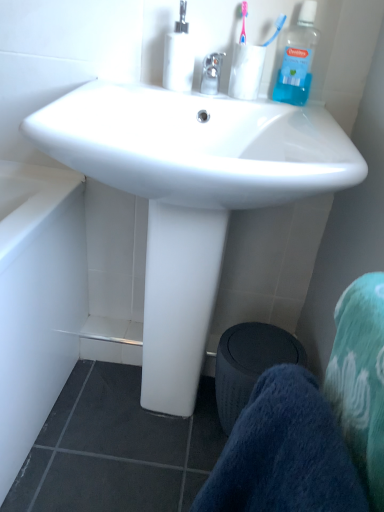
Question: Would you say black fabric trash bin/can at lower center is a long distance from transparent plastic cup at upper center?

Choices:
 (A) yes
 (B) no

Answer: (B)

Question: Is black fabric trash bin/can at lower center at the right side of transparent plastic cup at upper center?

Choices:
 (A) yes
 (B) no

Answer: (A)

Question: Can you confirm if black fabric trash bin/can at lower center is smaller than transparent plastic cup at upper center?

Choices:
 (A) yes
 (B) no

Answer: (B)

Question: Is black fabric trash bin/can at lower center at the left side of transparent plastic cup at upper center?

Choices:
 (A) yes
 (B) no

Answer: (B)

Question: Could transparent plastic cup at upper center be considered to be inside black fabric trash bin/can at lower center?

Choices:
 (A) yes
 (B) no

Answer: (B)

Question: From a real-world perspective, is black fabric trash bin/can at lower center beneath transparent plastic cup at upper center?

Choices:
 (A) no
 (B) yes

Answer: (B)

Question: Considering the relative sizes of clear glass faucet at center and black fabric trash bin/can at lower center in the image provided, is clear glass faucet at center smaller than black fabric trash bin/can at lower center?

Choices:
 (A) yes
 (B) no

Answer: (A)

Question: From a real-world perspective, is clear glass faucet at center beneath black fabric trash bin/can at lower center?

Choices:
 (A) no
 (B) yes

Answer: (A)

Question: Does clear glass faucet at center have a greater height compared to black fabric trash bin/can at lower center?

Choices:
 (A) no
 (B) yes

Answer: (A)

Question: Can you confirm if clear glass faucet at center is positioned to the right of black fabric trash bin/can at lower center?

Choices:
 (A) yes
 (B) no

Answer: (B)

Question: Is the position of clear glass faucet at center more distant than that of black fabric trash bin/can at lower center?

Choices:
 (A) no
 (B) yes

Answer: (A)

Question: Is clear glass faucet at center in front of black fabric trash bin/can at lower center?

Choices:
 (A) no
 (B) yes

Answer: (B)

Question: Can you confirm if blue soft towel at lower right is bigger than blue plastic toothbrush at upper right?

Choices:
 (A) yes
 (B) no

Answer: (A)